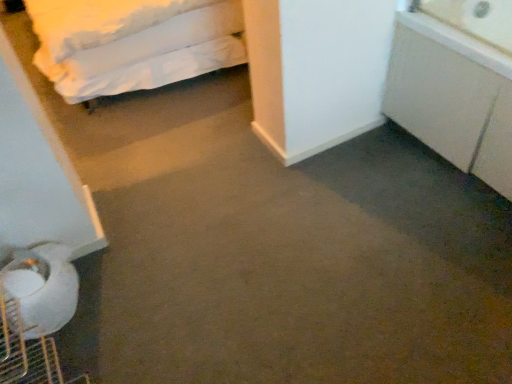
Question: From a real-world perspective, is white soft bed at upper left under white matte cabinet at right?

Choices:
 (A) yes
 (B) no

Answer: (B)

Question: Is white soft bed at upper left bigger than white matte cabinet at right?

Choices:
 (A) yes
 (B) no

Answer: (A)

Question: Considering the relative positions of white soft bed at upper left and white matte cabinet at right in the image provided, is white soft bed at upper left behind white matte cabinet at right?

Choices:
 (A) no
 (B) yes

Answer: (B)

Question: Is white soft bed at upper left oriented towards white matte cabinet at right?

Choices:
 (A) no
 (B) yes

Answer: (A)

Question: From the image's perspective, is white soft bed at upper left beneath white matte cabinet at right?

Choices:
 (A) yes
 (B) no

Answer: (B)

Question: Considering the relative sizes of white soft bed at upper left and white matte cabinet at right in the image provided, is white soft bed at upper left taller than white matte cabinet at right?

Choices:
 (A) yes
 (B) no

Answer: (A)

Question: From the image's perspective, is white matte cabinet at right located above white soft bed at upper left?

Choices:
 (A) no
 (B) yes

Answer: (A)

Question: Does white matte cabinet at right turn towards white soft bed at upper left?

Choices:
 (A) no
 (B) yes

Answer: (A)

Question: Are white matte cabinet at right and white soft bed at upper left located far from each other?

Choices:
 (A) yes
 (B) no

Answer: (B)

Question: From the image's perspective, is white matte cabinet at right located beneath white soft bed at upper left?

Choices:
 (A) yes
 (B) no

Answer: (A)

Question: From a real-world perspective, is white matte cabinet at right positioned over white soft bed at upper left based on gravity?

Choices:
 (A) yes
 (B) no

Answer: (B)

Question: Considering the relative sizes of white matte cabinet at right and white soft bed at upper left in the image provided, is white matte cabinet at right shorter than white soft bed at upper left?

Choices:
 (A) no
 (B) yes

Answer: (B)

Question: Considering the positions of white matte cabinet at right and white soft bed at upper left in the image, is white matte cabinet at right wider or thinner than white soft bed at upper left?

Choices:
 (A) wide
 (B) thin

Answer: (B)